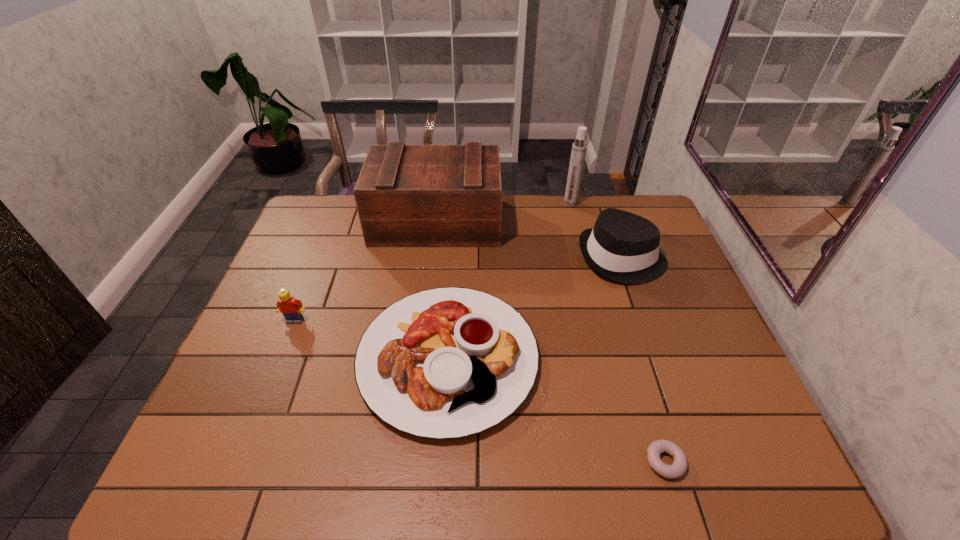
Find the location of a particular element. Image resolution: width=960 pixels, height=540 pixels. the tallest object is located at coordinates (579, 147).

Identify the location of box. (406, 195).

At what (x,y) coordinates should I click in order to perform the action: click on the fourth shortest object. Please return your answer as a coordinate pair (x, y). This screenshot has height=540, width=960. Looking at the image, I should click on (622, 246).

Identify the location of the third shortest object. (291, 308).

Locate an element on the screen. This screenshot has width=960, height=540. the leftmost object is located at coordinates (291, 308).

This screenshot has width=960, height=540. What are the coordinates of `the second shortest object` in the screenshot? It's located at (449, 362).

At what (x,y) coordinates should I click in order to perform the action: click on the shortest object. Please return your answer as a coordinate pair (x, y). Looking at the image, I should click on (678, 468).

Find the location of a particular element. free space located on the left of the aerosol can is located at coordinates (503, 203).

Where is `free spot located 0.130m on the left of the box`? The height and width of the screenshot is (540, 960). free spot located 0.130m on the left of the box is located at coordinates [336, 221].

You are a GUI agent. You are given a task and a screenshot of the screen. Output one action in this format:
    pyautogui.click(x=<x>, y=<y>)
    Task: Click on the free location located on the left of the fedora
    This screenshot has height=540, width=960.
    Given the screenshot: What is the action you would take?
    pyautogui.click(x=494, y=258)